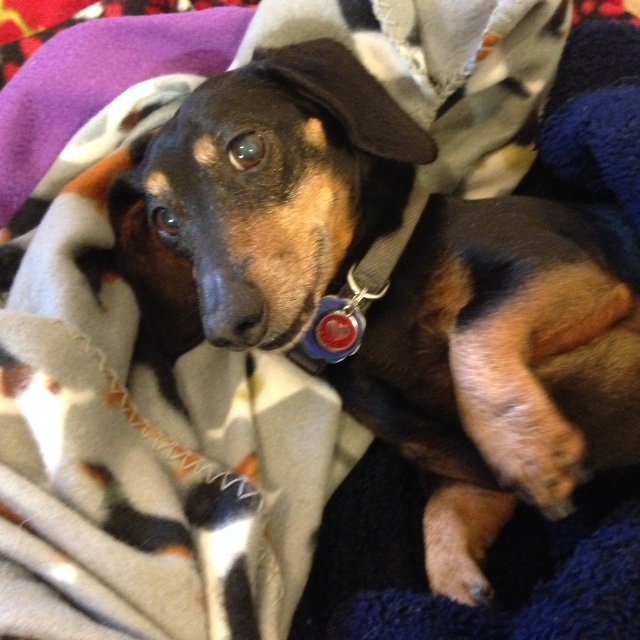
Image resolution: width=640 pixels, height=640 pixels. What are the coordinates of `chest` in the screenshot? It's located at (392, 393).